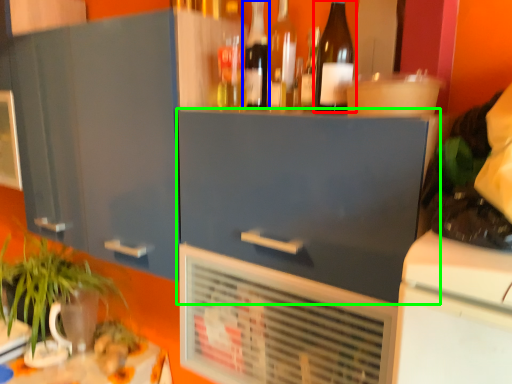
Question: Which is farther away from bottle (highlighted by a red box)? bottle (highlighted by a blue box) or cabinetry (highlighted by a green box)?

Choices:
 (A) bottle
 (B) cabinetry

Answer: (B)